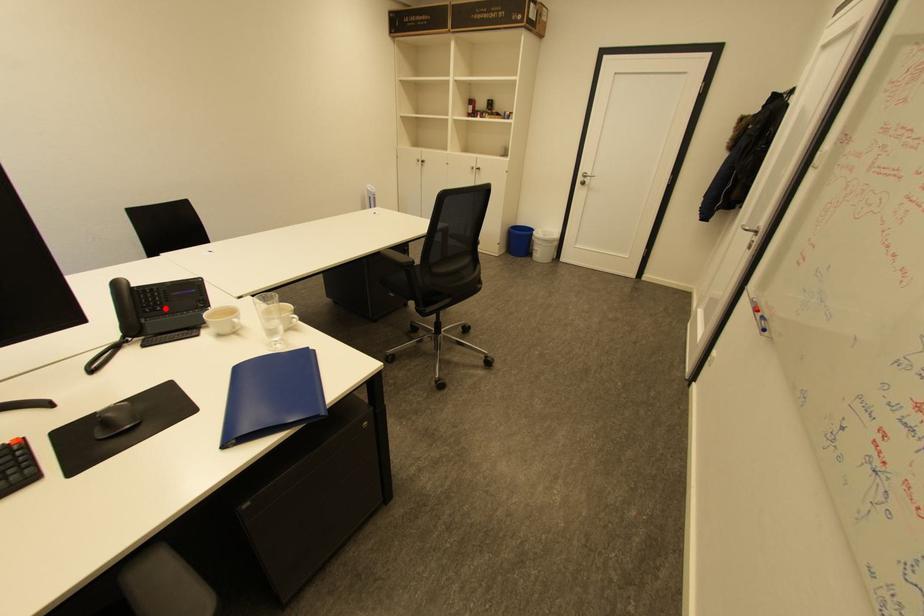
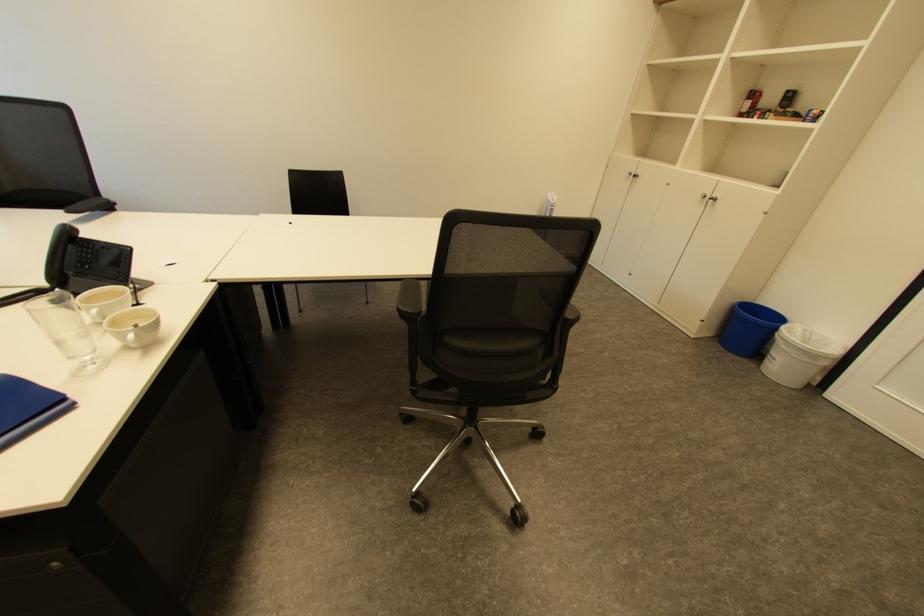
Question: I am providing you with two images of the same scene from different viewpoints. A red point is marked on the first image. Can you still see the location of the red point in image 2?

Choices:
 (A) Yes
 (B) No

Answer: (A)